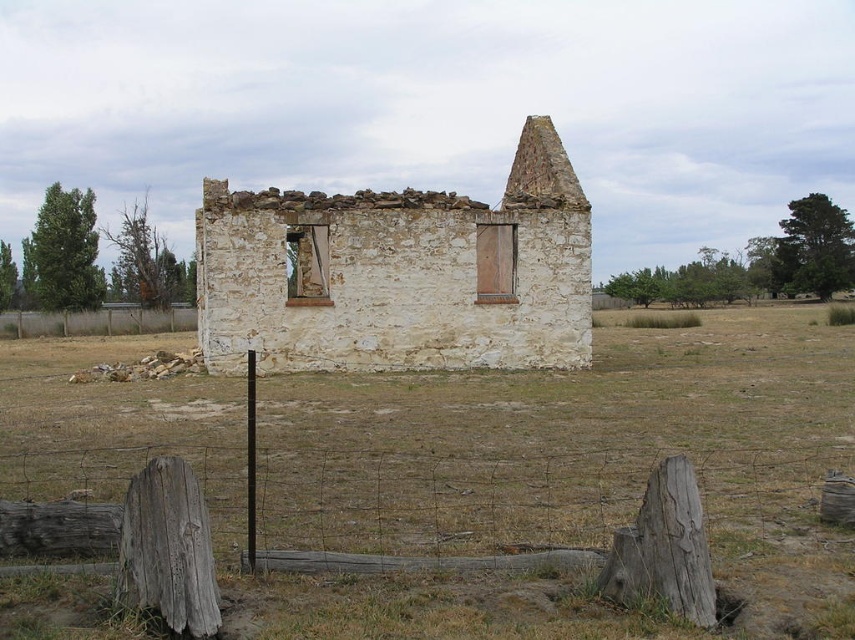
Consider the image. Between white stone wall at center and brown wooden fence at lower left, which one is positioned higher?

white stone wall at center

In the scene shown: Can you confirm if white stone wall at center is shorter than brown wooden fence at lower left?

Incorrect, white stone wall at center's height does not fall short of brown wooden fence at lower left's.

Is point (304, 262) closer to camera compared to point (81, 314)?

Yes.

At what (x,y) coordinates should I click in order to perform the action: click on white stone wall at center. Please return your answer as a coordinate pair (x, y). Looking at the image, I should click on (399, 273).